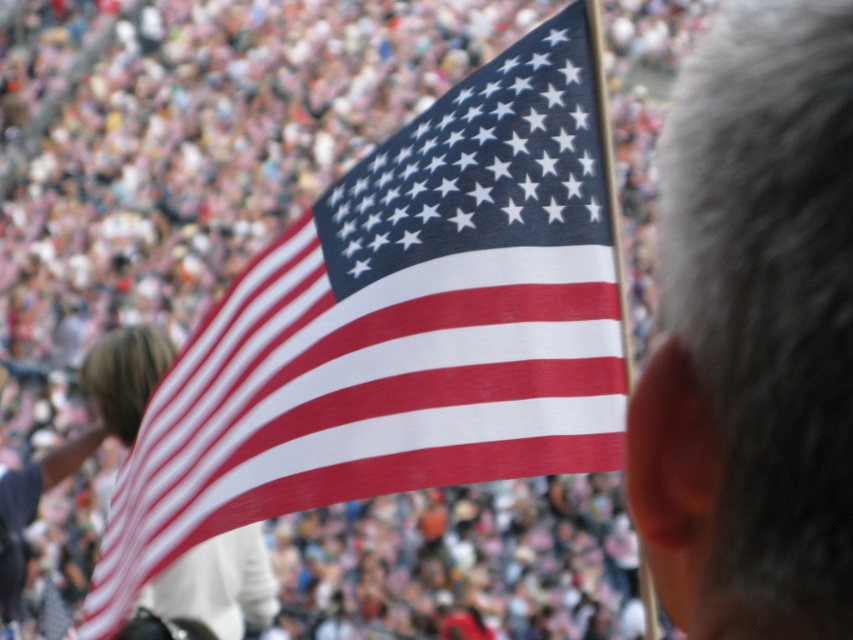
Is matte fabric flag at center taller than gray hair at upper right?

Yes.

Find the location of a particular element. This screenshot has width=853, height=640. matte fabric flag at center is located at coordinates (401, 326).

This screenshot has height=640, width=853. I want to click on matte fabric flag at center, so click(401, 326).